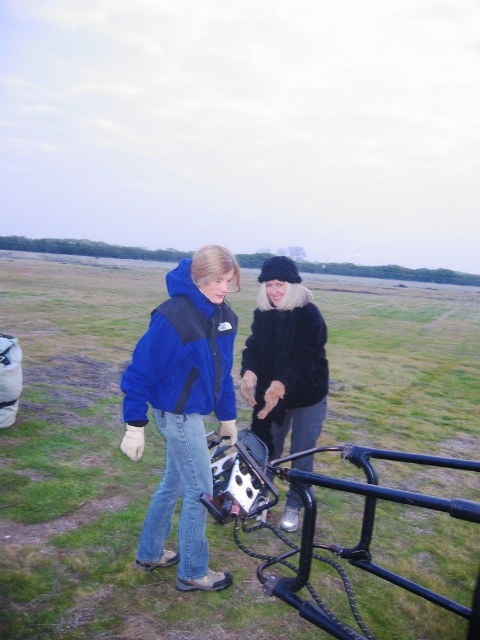
Question: Among these objects, which one is farthest from the camera?

Choices:
 (A) black matte camera at center
 (B) black fur coat at center

Answer: (B)

Question: Among these objects, which one is farthest from the camera?

Choices:
 (A) blue fleece jacket at center
 (B) black matte camera at center

Answer: (B)

Question: Does black matte camera at center have a larger size compared to blue fleece jacket at center?

Choices:
 (A) yes
 (B) no

Answer: (A)

Question: Does blue fleece jacket at center have a smaller size compared to black metal rail at lower center?

Choices:
 (A) no
 (B) yes

Answer: (B)

Question: Among these points, which one is nearest to the camera?

Choices:
 (A) (127, 422)
 (B) (370, 474)

Answer: (B)

Question: Is black matte camera at center to the right of blue fleece jacket at center from the viewer's perspective?

Choices:
 (A) yes
 (B) no

Answer: (B)